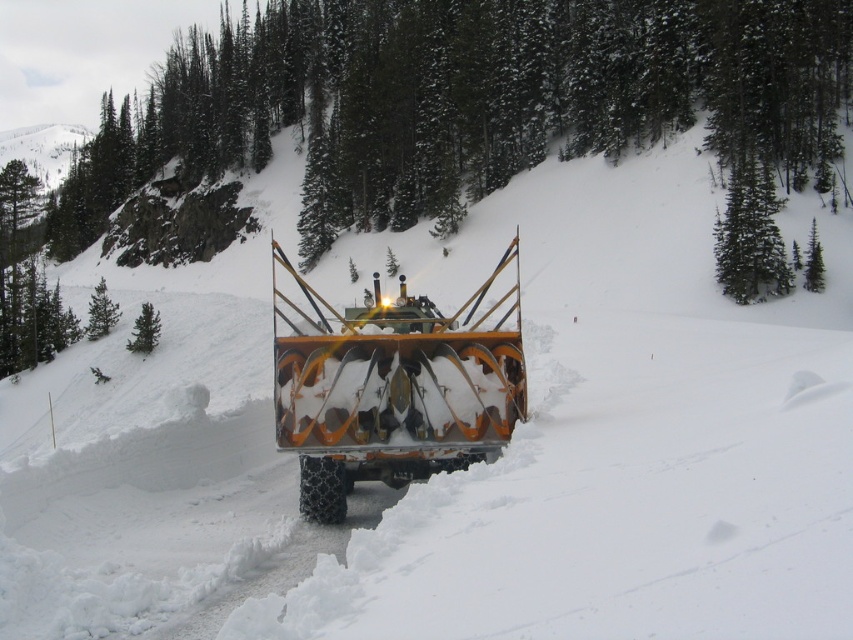
Question: Which point appears closest to the camera in this image?

Choices:
 (A) (160, 147)
 (B) (383, 376)
 (C) (741, 177)
 (D) (149, 307)

Answer: (B)

Question: Does green textured pine at center appear on the right side of orange metallic snowplow at center?

Choices:
 (A) no
 (B) yes

Answer: (A)

Question: Which object appears closest to the camera in this image?

Choices:
 (A) orange metallic snowplow at center
 (B) green textured pine at center
 (C) green textured pine tree at upper right
 (D) green matte tree at left

Answer: (A)

Question: Does orange metallic snowplow at center appear under green matte tree at left?

Choices:
 (A) yes
 (B) no

Answer: (B)

Question: Is orange metallic snowplow at center in front of green textured pine tree at upper right?

Choices:
 (A) yes
 (B) no

Answer: (A)

Question: Considering the real-world distances, which object is farthest from the green matte tree at left?

Choices:
 (A) green textured pine at center
 (B) green textured pine tree at upper right
 (C) orange metallic snowplow at center

Answer: (A)